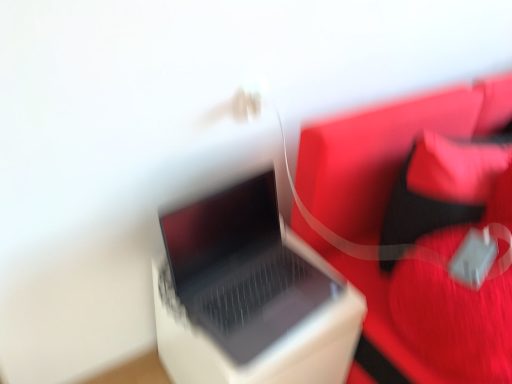
What do you see at coordinates (454, 256) in the screenshot? I see `velvet red bean bag chair at right` at bounding box center [454, 256].

Where is `rubberized red bag at right`? The height and width of the screenshot is (384, 512). rubberized red bag at right is located at coordinates (418, 225).

In order to face satin black laptop at center, should I rotate leftwards or rightwards?

You should look right and rotate roughly 1.165 degrees.

Image resolution: width=512 pixels, height=384 pixels. In order to click on velvet red bean bag chair at right in this screenshot , I will do `click(454, 256)`.

Between rubberized red bag at right and satin black laptop at center, which one appears on the left side from the viewer's perspective?

satin black laptop at center is more to the left.

Is rubberized red bag at right positioned in front of satin black laptop at center?

Yes, the depth of rubberized red bag at right is less than that of satin black laptop at center.

In the scene shown: Which of these two, rubberized red bag at right or satin black laptop at center, is smaller?

satin black laptop at center is smaller.

Between rubberized red bag at right and satin black laptop at center, which one has more height?

With more height is rubberized red bag at right.

Where is `furniture located above the white plastic laptop at center (from a real-world perspective)`? furniture located above the white plastic laptop at center (from a real-world perspective) is located at coordinates (418, 225).

What's the angular difference between white plastic laptop at center and rubberized red bag at right's facing directions?

There is a 0.000854-degree angle between the facing directions of white plastic laptop at center and rubberized red bag at right.

Is white plastic laptop at center to the left of rubberized red bag at right from the viewer's perspective?

Indeed, white plastic laptop at center is positioned on the left side of rubberized red bag at right.

How much distance is there between white plastic laptop at center and rubberized red bag at right?

33.37 centimeters.

Is velvet red bean bag chair at right at the back of rubberized red bag at right?

Yes, rubberized red bag at right is positioned with its back facing velvet red bean bag chair at right.

Which of these two, rubberized red bag at right or velvet red bean bag chair at right, stands taller?

Standing taller between the two is rubberized red bag at right.

Considering the relative positions of rubberized red bag at right and velvet red bean bag chair at right in the image provided, is rubberized red bag at right behind velvet red bean bag chair at right?

No, rubberized red bag at right is closer to the camera.

Considering the sizes of objects satin black laptop at center and velvet red bean bag chair at right in the image provided, who is smaller, satin black laptop at center or velvet red bean bag chair at right?

With smaller size is satin black laptop at center.

Considering the sizes of objects satin black laptop at center and velvet red bean bag chair at right in the image provided, who is thinner, satin black laptop at center or velvet red bean bag chair at right?

satin black laptop at center is thinner.

Between satin black laptop at center and velvet red bean bag chair at right, which one has more height?

velvet red bean bag chair at right is taller.

In the scene shown: Could you tell me if satin black laptop at center is facing velvet red bean bag chair at right?

No, satin black laptop at center is not aimed at velvet red bean bag chair at right.

How many degrees apart are the facing directions of rubberized red bag at right and white plastic laptop at center?

They differ by 0.000854 degrees in their facing directions.

From the image's perspective, is rubberized red bag at right under white plastic laptop at center?

Actually, rubberized red bag at right appears above white plastic laptop at center in the image.

Between rubberized red bag at right and white plastic laptop at center, which one has larger size?

Bigger between the two is rubberized red bag at right.

Is rubberized red bag at right not within white plastic laptop at center?

rubberized red bag at right is positioned outside white plastic laptop at center.

From the image's perspective, who appears lower, satin black laptop at center or white plastic laptop at center?

white plastic laptop at center is shown below in the image.

Identify the location of laptop above the white plastic laptop at center (from a real-world perspective). The width and height of the screenshot is (512, 384). (240, 269).

Considering the relative sizes of satin black laptop at center and white plastic laptop at center in the image provided, is satin black laptop at center bigger than white plastic laptop at center?

No.

Between point (197, 250) and point (353, 294), which one is positioned in front?

The point (197, 250) is in front.

Which point is more distant from viewer, (x=297, y=338) or (x=252, y=256)?

The point (x=252, y=256) is more distant.

Who is smaller, white plastic laptop at center or satin black laptop at center?

satin black laptop at center.

From the image's perspective, is white plastic laptop at center beneath satin black laptop at center?

Yes, from the image's perspective, white plastic laptop at center is beneath satin black laptop at center.

Can we say white plastic laptop at center lies outside satin black laptop at center?

white plastic laptop at center lies outside satin black laptop at center's area.

Identify the location of furniture located on the right of satin black laptop at center. (418, 225).

The width and height of the screenshot is (512, 384). In order to click on furniture above the white plastic laptop at center (from a real-world perspective) in this screenshot , I will do (418, 225).

Which object lies nearer to the anchor point velvet red bean bag chair at right, satin black laptop at center or rubberized red bag at right?

rubberized red bag at right.

Based on their spatial positions, is velvet red bean bag chair at right or satin black laptop at center further from white plastic laptop at center?

The object further to white plastic laptop at center is velvet red bean bag chair at right.

When comparing their distances from velvet red bean bag chair at right, does satin black laptop at center or white plastic laptop at center seem further?

satin black laptop at center is further to velvet red bean bag chair at right.

Looking at this image, looking at the image, which one is located further to rubberized red bag at right, velvet red bean bag chair at right or satin black laptop at center?

satin black laptop at center.

Looking at the image, which one is located closer to velvet red bean bag chair at right, white plastic laptop at center or rubberized red bag at right?

rubberized red bag at right.

Estimate the real-world distances between objects in this image. Which object is closer to white plastic laptop at center, velvet red bean bag chair at right or rubberized red bag at right?

rubberized red bag at right is closer to white plastic laptop at center.

Which object lies nearer to the anchor point satin black laptop at center, rubberized red bag at right or velvet red bean bag chair at right?

rubberized red bag at right.

Looking at the image, which one is located further to satin black laptop at center, rubberized red bag at right or white plastic laptop at center?

rubberized red bag at right.

This screenshot has width=512, height=384. Find the location of `laptop between white plastic laptop at center and rubberized red bag at right in the horizontal direction`. laptop between white plastic laptop at center and rubberized red bag at right in the horizontal direction is located at coordinates (240, 269).

This screenshot has width=512, height=384. Find the location of `bean bag chair located between white plastic laptop at center and rubberized red bag at right in the left-right direction`. bean bag chair located between white plastic laptop at center and rubberized red bag at right in the left-right direction is located at coordinates (454, 256).

You are a GUI agent. You are given a task and a screenshot of the screen. Output one action in this format:
    pyautogui.click(x=<x>, y=<y>)
    Task: Click on the laptop situated between white plastic laptop at center and velvet red bean bag chair at right from left to right
    
    Given the screenshot: What is the action you would take?
    pyautogui.click(x=240, y=269)

Identify the location of bean bag chair situated between satin black laptop at center and rubberized red bag at right from left to right. This screenshot has height=384, width=512. (454, 256).